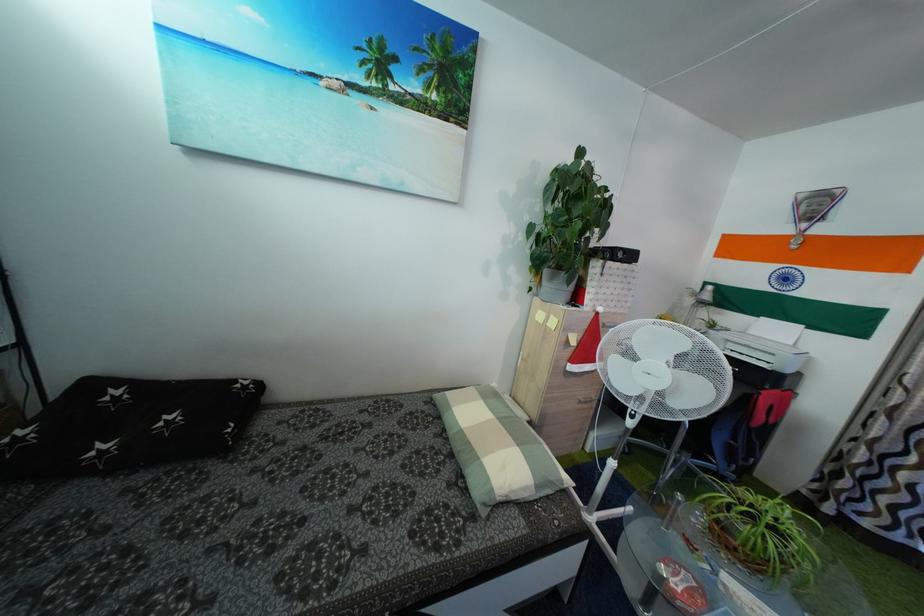
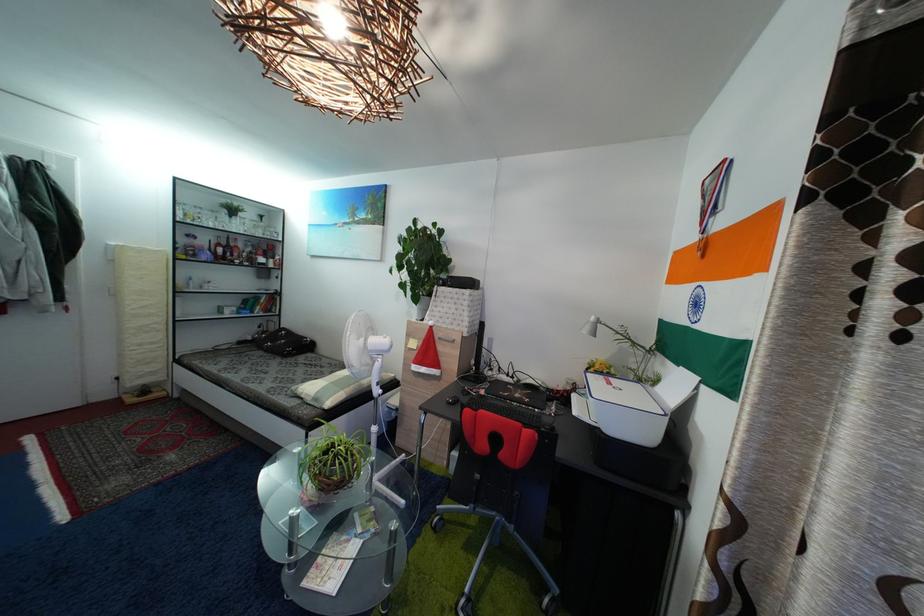
The point at (596, 304) is marked in the first image. Where is the corresponding point in the second image?

(435, 321)